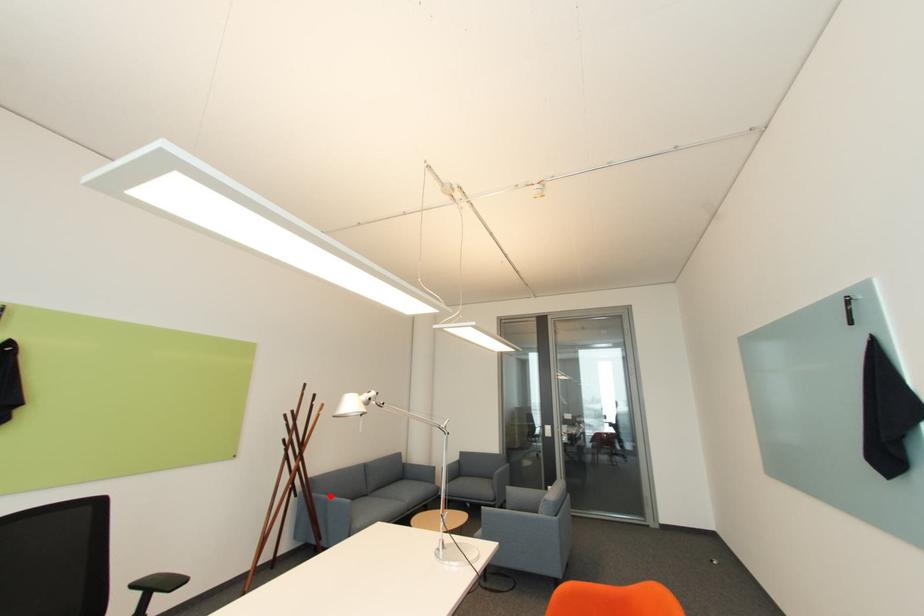
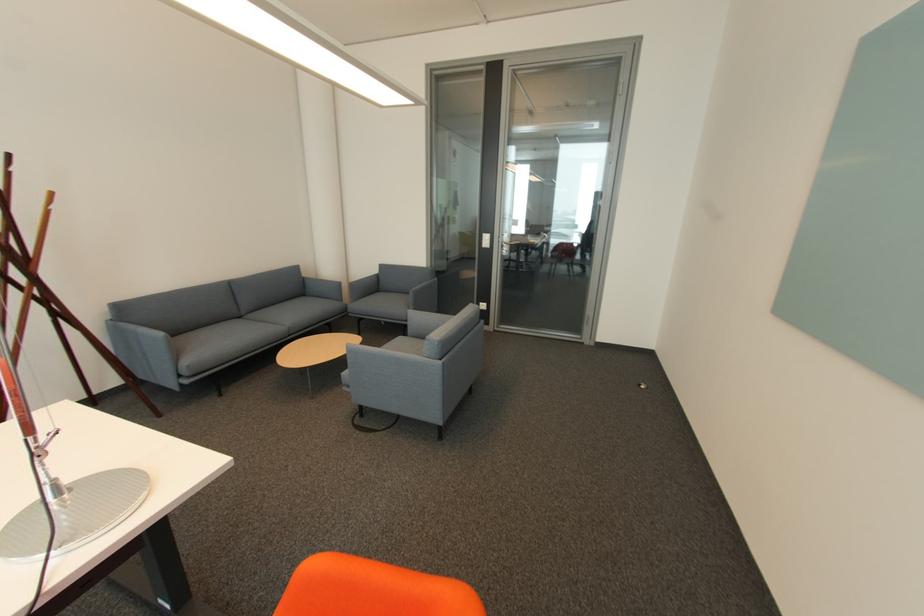
Find the pixel in the second image that matches the highlighted location in the first image.

(139, 328)